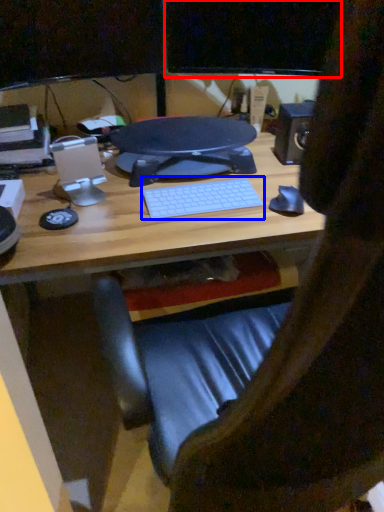
Question: Which point is closer to the camera, computer monitor (highlighted by a red box) or computer keyboard (highlighted by a blue box)?

Choices:
 (A) computer monitor
 (B) computer keyboard

Answer: (B)